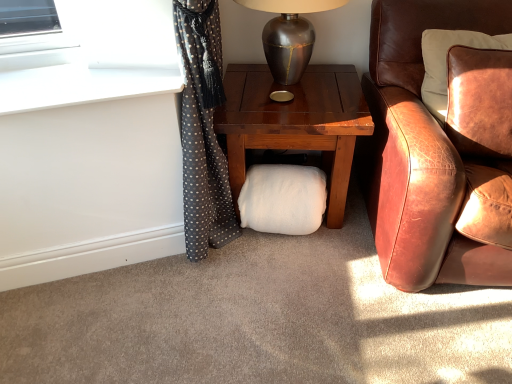
Locate an element on the screen. The width and height of the screenshot is (512, 384). vacant area on top of wooden nightstand at center (from a real-world perspective) is located at coordinates (290, 91).